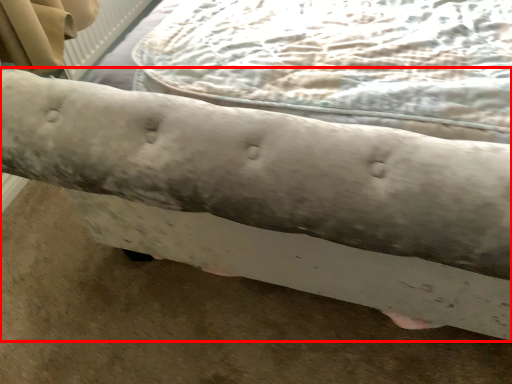
Question: Considering the relative positions of furniture (annotated by the red box) and sheet in the image provided, where is furniture (annotated by the red box) located with respect to the staircase?

Choices:
 (A) left
 (B) right

Answer: (B)